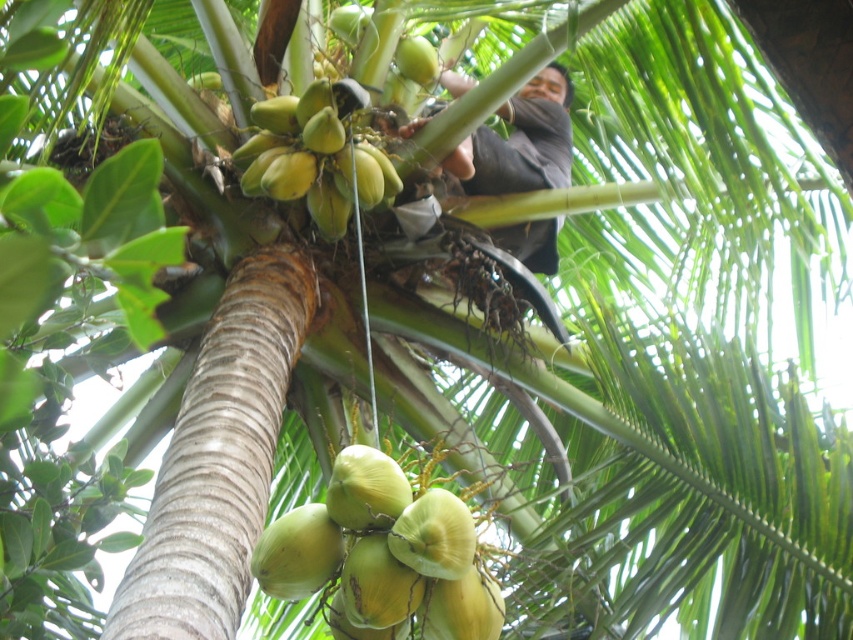
Question: Does green matte coconut at center have a lesser width compared to green matte coconut at upper center?

Choices:
 (A) yes
 (B) no

Answer: (A)

Question: Does green matte coconut at center appear under green matte coconut at upper center?

Choices:
 (A) no
 (B) yes

Answer: (B)

Question: Which object appears closest to the camera in this image?

Choices:
 (A) green matte coconut at upper center
 (B) dark brown fabric at center

Answer: (A)

Question: Which object is positioned closest to the green matte coconut at upper center?

Choices:
 (A) green matte coconut at center
 (B) dark brown fabric at center

Answer: (B)

Question: Does green matte coconut at center have a lesser width compared to dark brown fabric at center?

Choices:
 (A) no
 (B) yes

Answer: (B)

Question: Which point is closer to the camera taking this photo?

Choices:
 (A) (383, 512)
 (B) (546, 225)
 (C) (309, 188)

Answer: (A)